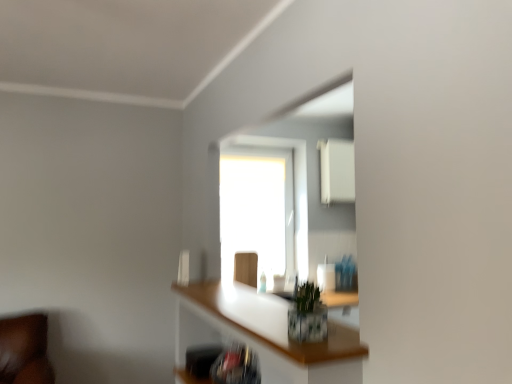
Question: Is transparent glass window at center in front of or behind green leafy plant at center in the image?

Choices:
 (A) front
 (B) behind

Answer: (B)

Question: In terms of width, does transparent glass window at center look wider or thinner when compared to green leafy plant at center?

Choices:
 (A) thin
 (B) wide

Answer: (A)

Question: Which object is the closest to the wooden swivel chair at center?

Choices:
 (A) green leafy plant at center
 (B) transparent glass window at center
 (C) translucent glass shelf at center

Answer: (B)

Question: Which of these objects is positioned closest to the wooden swivel chair at center?

Choices:
 (A) green leafy plant at center
 (B) transparent glass window at center
 (C) translucent glass shelf at center

Answer: (B)